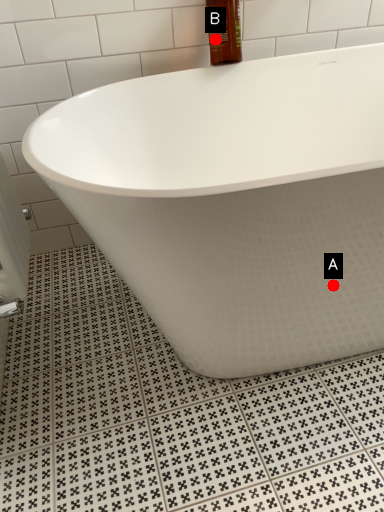
Question: Two points are circled on the image, labeled by A and B beside each circle. Which point is closer to the camera?

Choices:
 (A) A is closer
 (B) B is closer

Answer: (A)